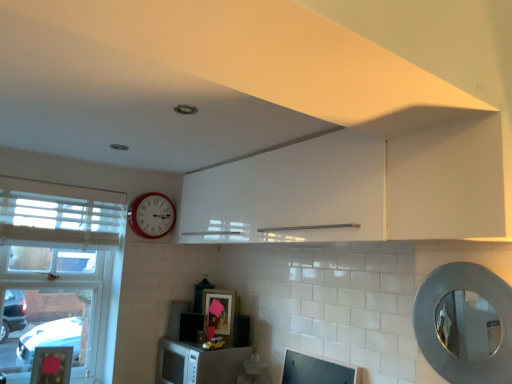
Question: Does black matte microwave at center, the 2th appliance when ordered from left to right, touch silver textured mirror at right?

Choices:
 (A) no
 (B) yes

Answer: (A)

Question: Can you confirm if black matte microwave at center, acting as the first appliance starting from the right, is shorter than silver textured mirror at right?

Choices:
 (A) no
 (B) yes

Answer: (B)

Question: Is silver textured mirror at right completely or partially inside black matte microwave at center, which ranks as the 1th appliance in front-to-back order?

Choices:
 (A) no
 (B) yes

Answer: (A)

Question: Does black matte microwave at center, which ranks as the 1th appliance in front-to-back order, have a smaller size compared to silver textured mirror at right?

Choices:
 (A) yes
 (B) no

Answer: (A)

Question: Is black matte microwave at center, the 2th appliance when ordered from left to right, bigger than silver textured mirror at right?

Choices:
 (A) yes
 (B) no

Answer: (B)

Question: From a real-world perspective, is black matte microwave at center, the 2th appliance when ordered from left to right, over silver textured mirror at right?

Choices:
 (A) no
 (B) yes

Answer: (A)

Question: Considering the relative sizes of satin black microwave at lower center, which ranks as the 2th appliance in right-to-left order, and white glossy cabinet at upper center in the image provided, is satin black microwave at lower center, which ranks as the 2th appliance in right-to-left order, thinner than white glossy cabinet at upper center?

Choices:
 (A) yes
 (B) no

Answer: (B)

Question: Is the surface of satin black microwave at lower center, positioned as the 1th appliance in left-to-right order, in direct contact with white glossy cabinet at upper center?

Choices:
 (A) no
 (B) yes

Answer: (A)

Question: Can you confirm if satin black microwave at lower center, which appears as the first appliance when viewed from the back, is positioned to the left of white glossy cabinet at upper center?

Choices:
 (A) yes
 (B) no

Answer: (A)

Question: Considering the relative sizes of satin black microwave at lower center, positioned as the 1th appliance in left-to-right order, and white glossy cabinet at upper center in the image provided, is satin black microwave at lower center, positioned as the 1th appliance in left-to-right order, taller than white glossy cabinet at upper center?

Choices:
 (A) no
 (B) yes

Answer: (A)

Question: From the image's perspective, would you say satin black microwave at lower center, which appears as the first appliance when viewed from the back, is shown under white glossy cabinet at upper center?

Choices:
 (A) yes
 (B) no

Answer: (A)

Question: From a real-world perspective, is satin black microwave at lower center, positioned as the 1th appliance in left-to-right order, physically above white glossy cabinet at upper center?

Choices:
 (A) no
 (B) yes

Answer: (A)

Question: Does matte black monitor at lower center have a larger size compared to white matte microwave at lower center?

Choices:
 (A) no
 (B) yes

Answer: (A)